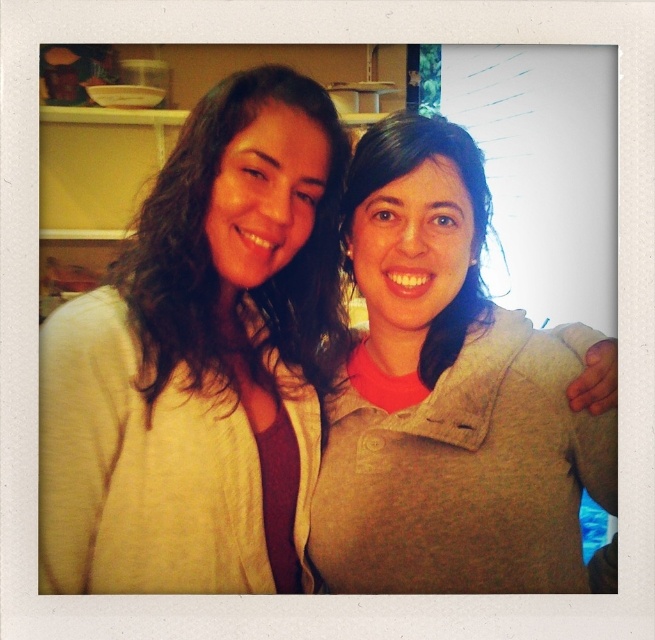
You are a tailor measuring the distance between yourself and the matte white cardigan at left to ensure proper fitting. Given that your arms are 24 inches long, can you comfortably reach to adjust the cardigan without moving closer?

The matte white cardigan at left and viewer are 28.28 inches apart. Since your arms are 24 inches long, you cannot comfortably reach to adjust the cardigan without moving closer as the distance is greater than your arm length.

You are standing in a kitchen and want to reach a point marked at coordinates (147, 337). If your arm can extend 30 inches, can you reach that point without moving closer?

The distance between you and the point (147, 337) is 31.91 inches. Since your arm can only extend 30 inches, you cannot reach it without moving closer.

You are trying to decide which top to wear for a casual day out. You have the matte white cardigan at left and the matte gray sweater at center. Based on their sizes, which one would you choose if you prefer a more oversized look?

The matte white cardigan at left is larger in size than the matte gray sweater at center, so you should choose the matte white cardigan at left for a more oversized look.